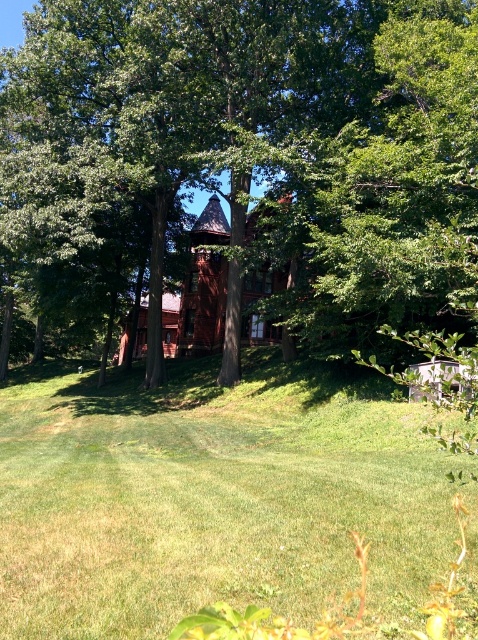
Between green leafy tree at center and red wood chapel at center, which one is positioned lower?

Positioned lower is red wood chapel at center.

Can you confirm if green leafy tree at center is positioned above red wood chapel at center?

Indeed, green leafy tree at center is positioned over red wood chapel at center.

Identify the location of green leafy tree at center. This screenshot has height=640, width=478. (260, 140).

Where is `green leafy tree at center`? This screenshot has height=640, width=478. green leafy tree at center is located at coordinates (260, 140).

Is green leafy tree at center further to the viewer compared to green grass at center?

That is True.

Is green leafy tree at center smaller than green grass at center?

No.

Identify the location of green leafy tree at center. The width and height of the screenshot is (478, 640). (260, 140).

Identify the location of green leafy tree at center. (260, 140).

Can you confirm if green grass at center is smaller than red wood chapel at center?

Yes, green grass at center is smaller than red wood chapel at center.

This screenshot has height=640, width=478. Identify the location of green grass at center. (214, 497).